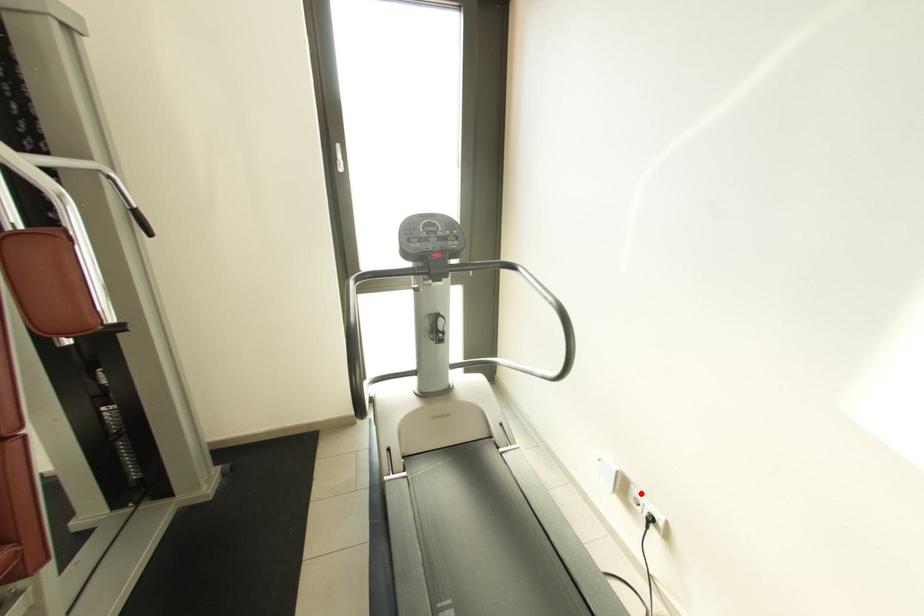
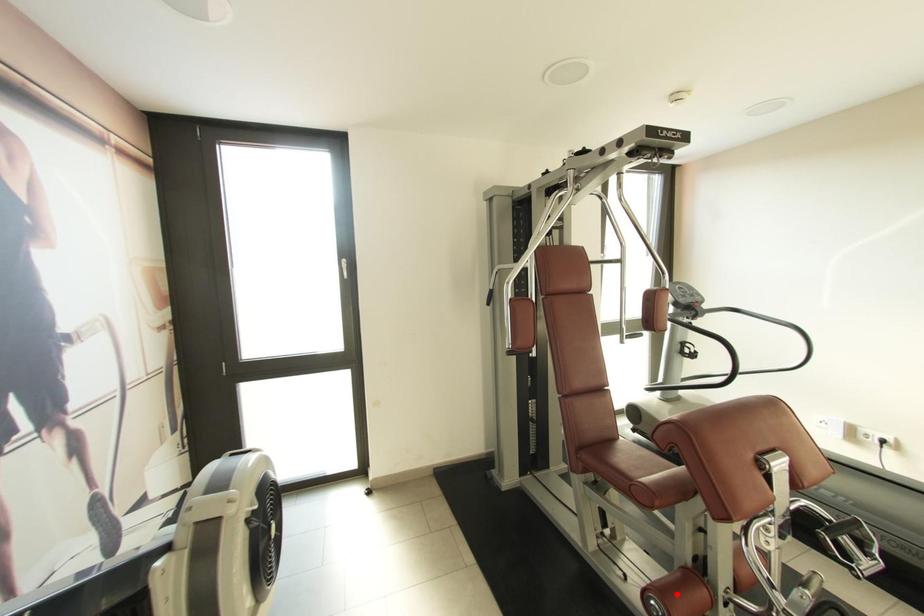
I am providing you with two images of the same scene from different viewpoints. A red point is marked on the first image and another point is marked on the second image. Does the point marked in image1 correspond to the same location as the one in image2?

No